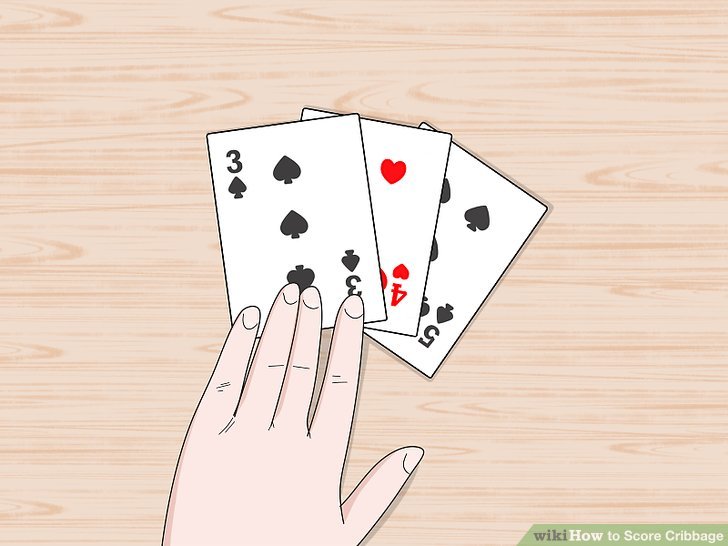
Image resolution: width=728 pixels, height=546 pixels. In order to click on playing cards in this screenshot , I will do click(x=327, y=207), click(x=384, y=210), click(x=466, y=245).